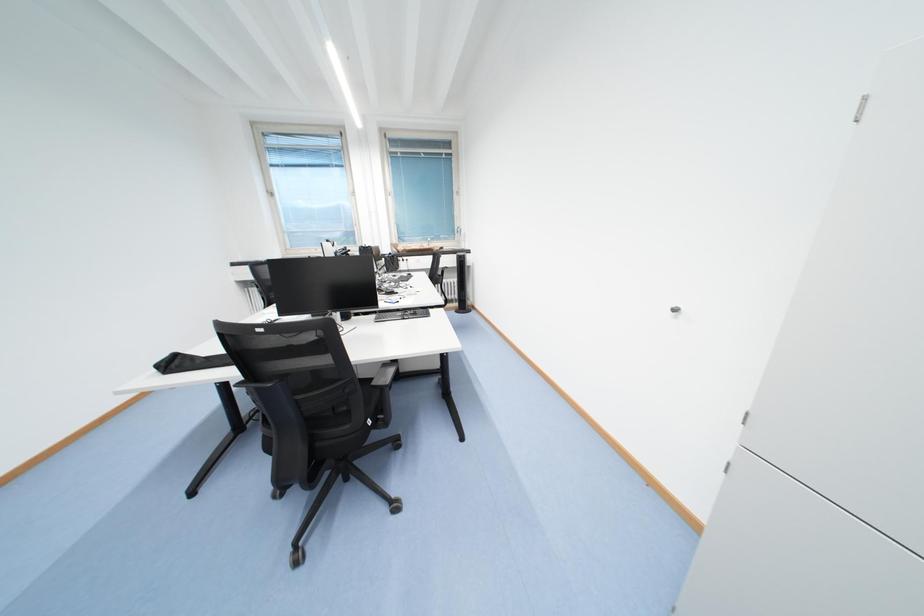
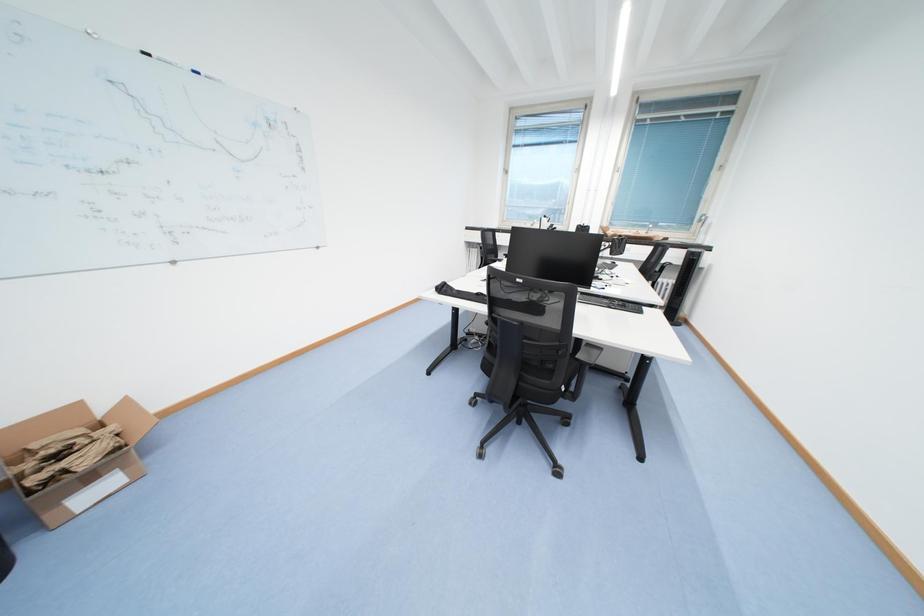
Question: The images are taken continuously from a first-person perspective. In which direction is your viewpoint rotating?

Choices:
 (A) Left
 (B) Right
 (C) Up
 (D) Down

Answer: (A)